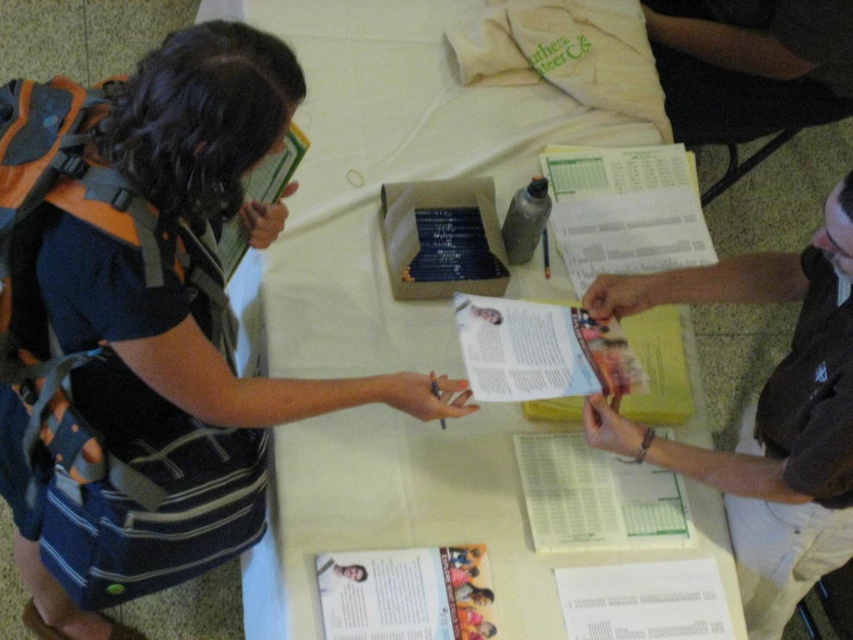
Between matte black backpack at left and dark brown leather wallet at center, which one has more height?

matte black backpack at left

Locate an element on the screen. This screenshot has width=853, height=640. matte black backpack at left is located at coordinates 144,324.

Can you confirm if matte black backpack at left is shorter than white paper at center?

Indeed, matte black backpack at left has a lesser height compared to white paper at center.

Does matte black backpack at left appear on the left side of white paper at center?

Correct, you'll find matte black backpack at left to the left of white paper at center.

Find the location of `matte black backpack at left`. matte black backpack at left is located at coordinates (144, 324).

Which is behind, point (331, 44) or point (787, 609)?

Positioned behind is point (331, 44).

Image resolution: width=853 pixels, height=640 pixels. Identify the location of white paper at center. (380, 177).

This screenshot has width=853, height=640. Find the location of `white paper at center`. white paper at center is located at coordinates (380, 177).